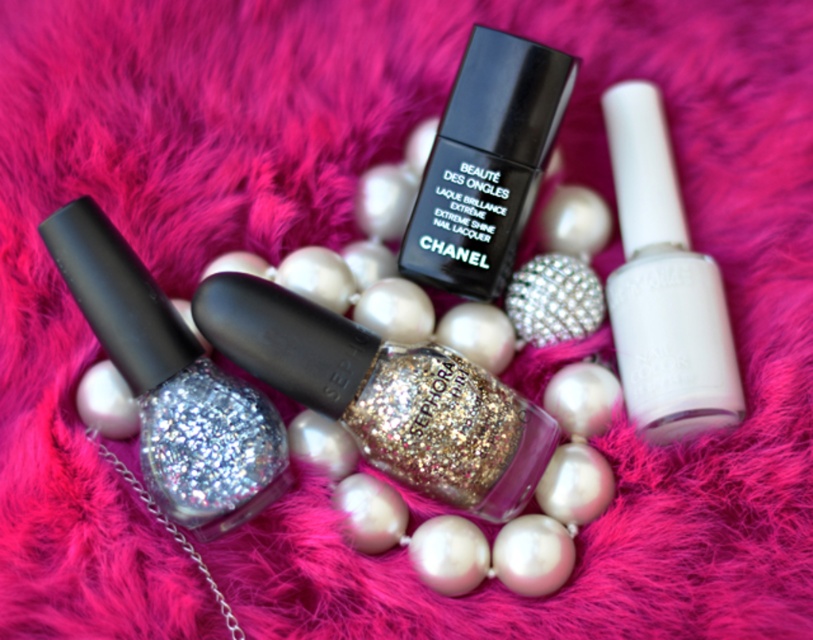
Consider the image. Is white glossy nail polish at upper right to the right of black matte nail polish at center from the viewer's perspective?

Correct, you'll find white glossy nail polish at upper right to the right of black matte nail polish at center.

Can you confirm if white glossy nail polish at upper right is positioned to the left of black matte nail polish at center?

Incorrect, white glossy nail polish at upper right is not on the left side of black matte nail polish at center.

Between point (633, 211) and point (463, 134), which one is positioned in front?

Point (463, 134)

This screenshot has width=813, height=640. What are the coordinates of `white glossy nail polish at upper right` in the screenshot? It's located at pyautogui.click(x=663, y=285).

Is point (324, 387) farther from viewer compared to point (566, 92)?

No, it is in front of (566, 92).

Which is behind, point (444, 486) or point (448, 140)?

Positioned behind is point (448, 140).

At what (x,y) coordinates should I click in order to perform the action: click on glittery metallic nail polish at center. Please return your answer as a coordinate pair (x, y). Looking at the image, I should click on (385, 396).

Is glittery silver nail polish at center to the right of black matte nail polish at center from the viewer's perspective?

In fact, glittery silver nail polish at center is to the left of black matte nail polish at center.

Between point (177, 330) and point (466, 253), which one is positioned behind?

Positioned behind is point (466, 253).

Find the location of `glittery silver nail polish at center`. glittery silver nail polish at center is located at coordinates (170, 384).